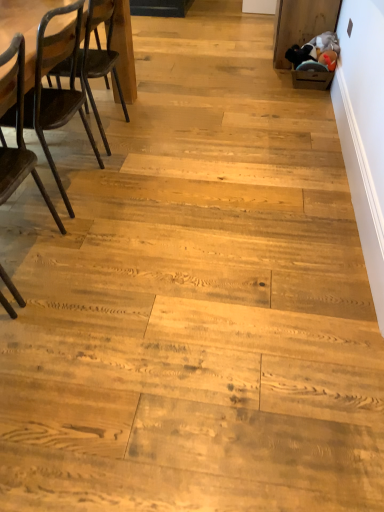
This screenshot has width=384, height=512. I want to click on free space in front of dark brown wood chair at left, the 1th chair viewed from the front, so click(x=42, y=339).